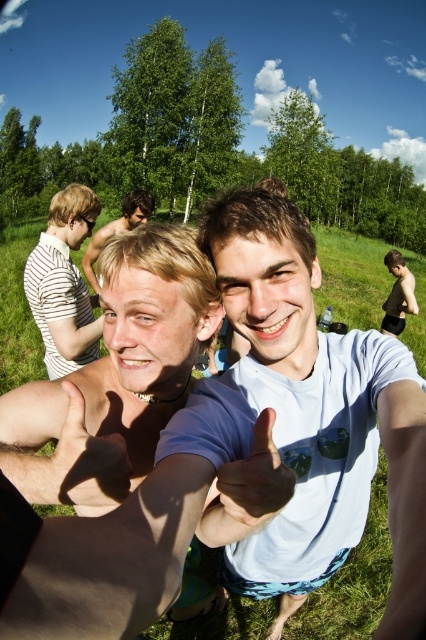
Question: Which of the following is the farthest from the observer?

Choices:
 (A) blonde hair at center
 (B) green grass at center
 (C) matte skin hand at center
 (D) striped fabric shirt at left

Answer: (D)

Question: Considering the real-world distances, which object is farthest from the blonde hair at center?

Choices:
 (A) smooth skin hand at center
 (B) striped fabric shirt at left
 (C) green grass at center

Answer: (C)

Question: Is green grass at center above striped fabric shirt at left?

Choices:
 (A) no
 (B) yes

Answer: (B)

Question: Which object is the farthest from the matte skin hand at center?

Choices:
 (A) matte black tank top at center
 (B) green grass at center

Answer: (A)

Question: Can you confirm if smooth skin hand at center is positioned to the right of matte skin hand at center?

Choices:
 (A) no
 (B) yes

Answer: (A)

Question: Is smooth skin hand at center thinner than matte black tank top at center?

Choices:
 (A) no
 (B) yes

Answer: (B)